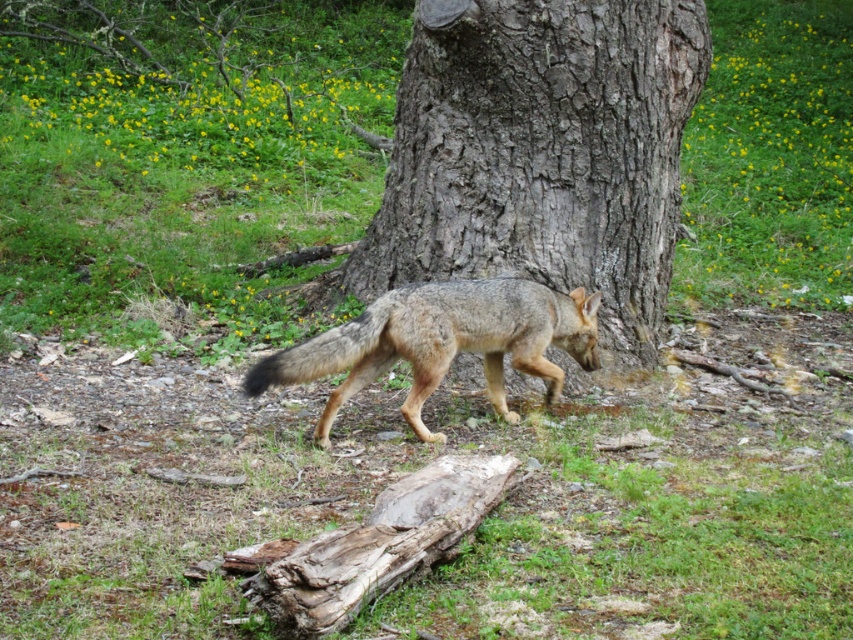
Question: Does gray bark tree at center appear on the left side of fur-like gray fox at center?

Choices:
 (A) yes
 (B) no

Answer: (B)

Question: Which object is farther from the camera taking this photo?

Choices:
 (A) fur-like gray fox at center
 (B) gray bark tree at center

Answer: (B)

Question: Which point is farther to the camera?

Choices:
 (A) (556, 371)
 (B) (483, 269)

Answer: (B)

Question: Can you confirm if gray bark tree at center is thinner than fur-like gray fox at center?

Choices:
 (A) no
 (B) yes

Answer: (A)

Question: Is gray bark tree at center to the right of fur-like gray fox at center from the viewer's perspective?

Choices:
 (A) yes
 (B) no

Answer: (A)